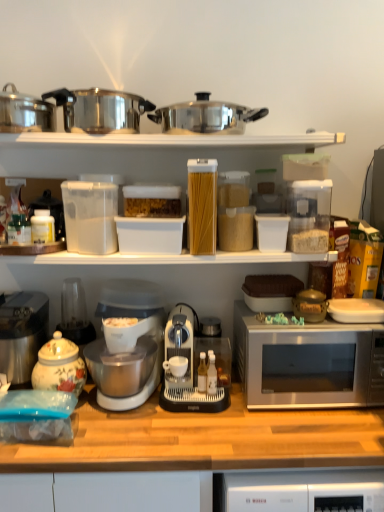
Locate an element on the screen. The width and height of the screenshot is (384, 512). vacant space in front of white plastic mixer at center is located at coordinates (131, 440).